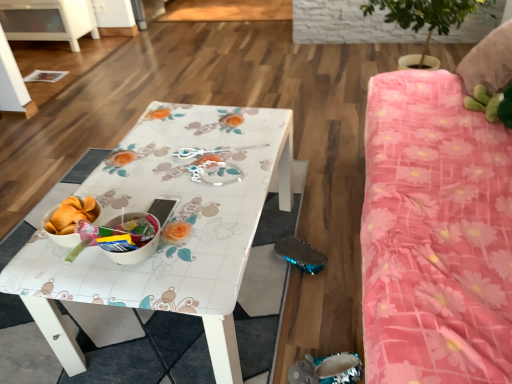
I want to click on free space behind clear plastic spoon at center, so click(225, 125).